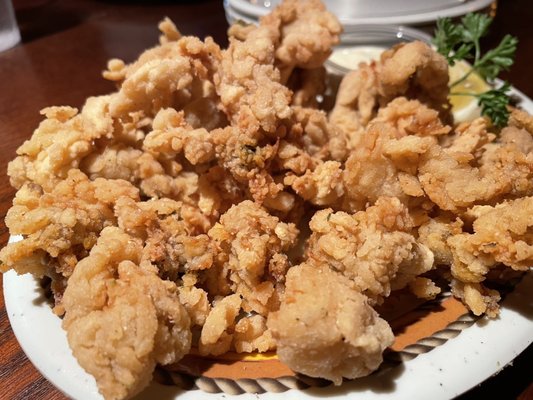
Where is `table`? This screenshot has width=533, height=400. table is located at coordinates (21, 385).